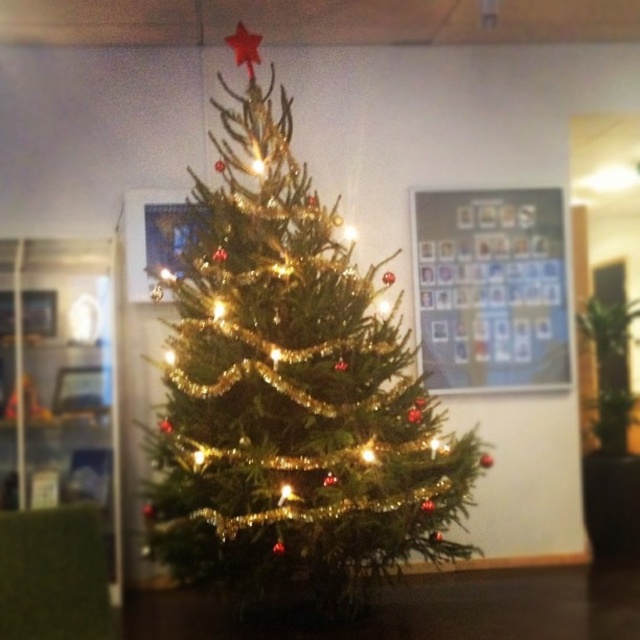
You are standing in front of the Christmas tree and want to place a gift under it. The gift requires a spot that is exactly 12.25 feet away from where you are standing. Is the point at coordinates point (433, 339) suitable for placing the gift?

The distance of point (433, 339) from viewer is 12.25 feet, so yes, the point at coordinates point (433, 339) is exactly 12.25 feet away from where you are standing, making it suitable for placing the gift.

In the scene shown: You are standing in front of the Christmas tree and want to hang an ornament. There are two points on the tree where you can place it. The first point is at coordinates point (378,406) and the second point is at coordinates point (522,241). Which point is closer to you?

Point (378,406) is closer to the viewer than point (522,241).

You are standing in front of a Christmas tree and want to place a decoration at the point marked by coordinates point (291, 396). Based on the scene description, where exactly on the tree would this point be located?

The point (291, 396) is located on the green shiny Christmas tree at center, so you should place the decoration there.